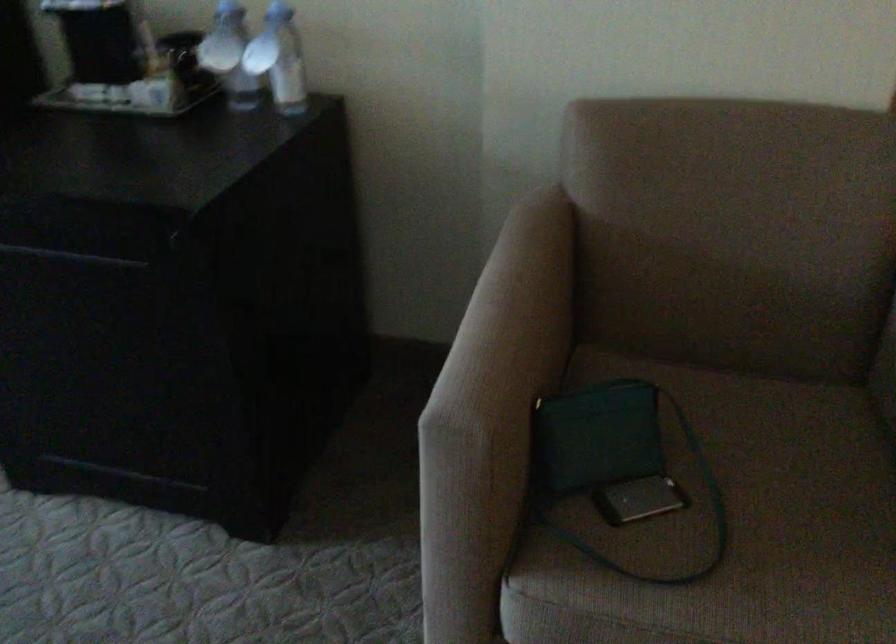
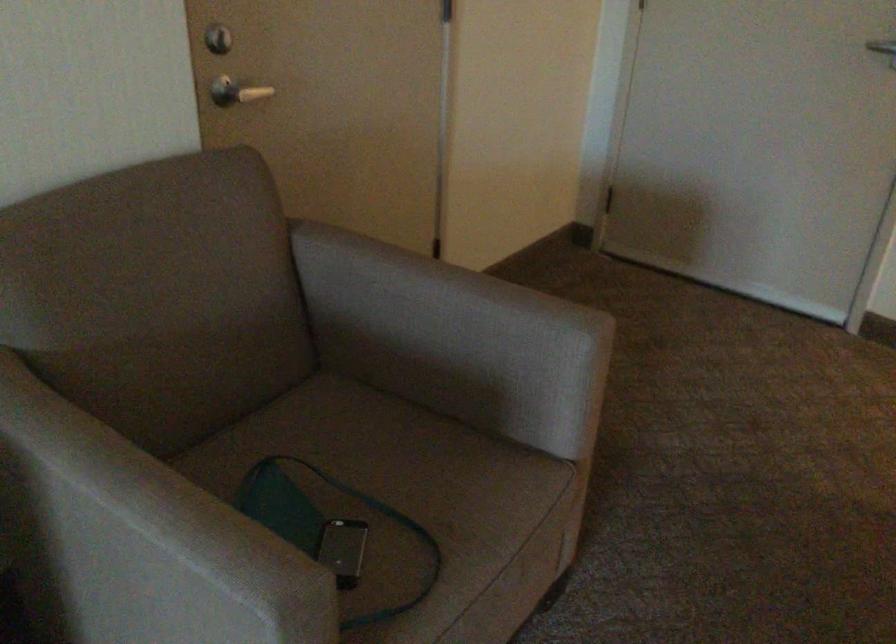
Locate, in the second image, the point that corresponds to (x=753, y=525) in the first image.

(412, 505)